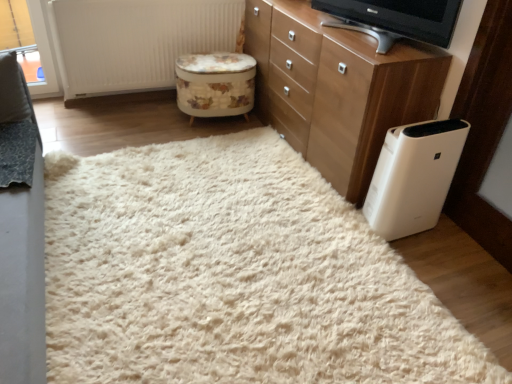
Where is `vacant space underneath matte black television at upper center (from a real-world perspective)`? The width and height of the screenshot is (512, 384). vacant space underneath matte black television at upper center (from a real-world perspective) is located at coordinates (355, 39).